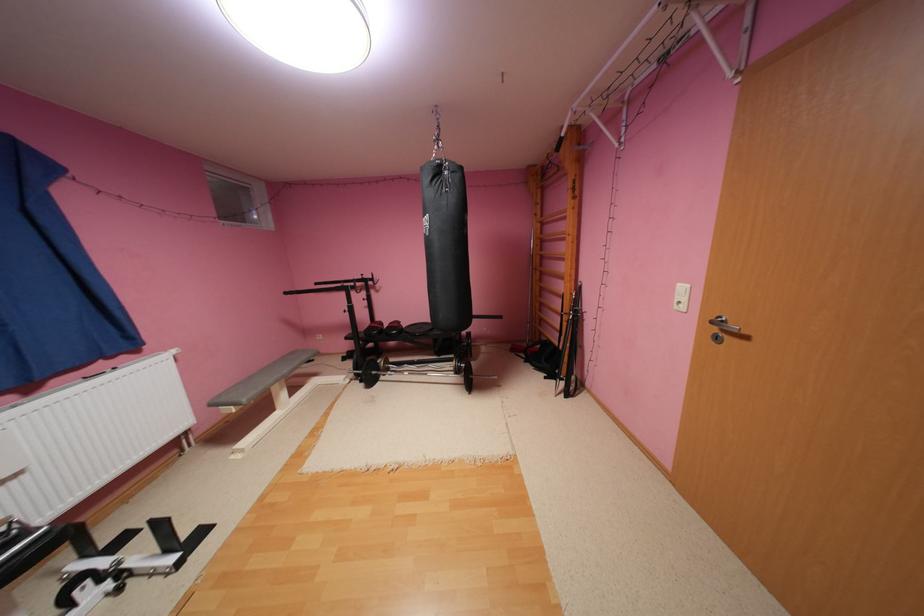
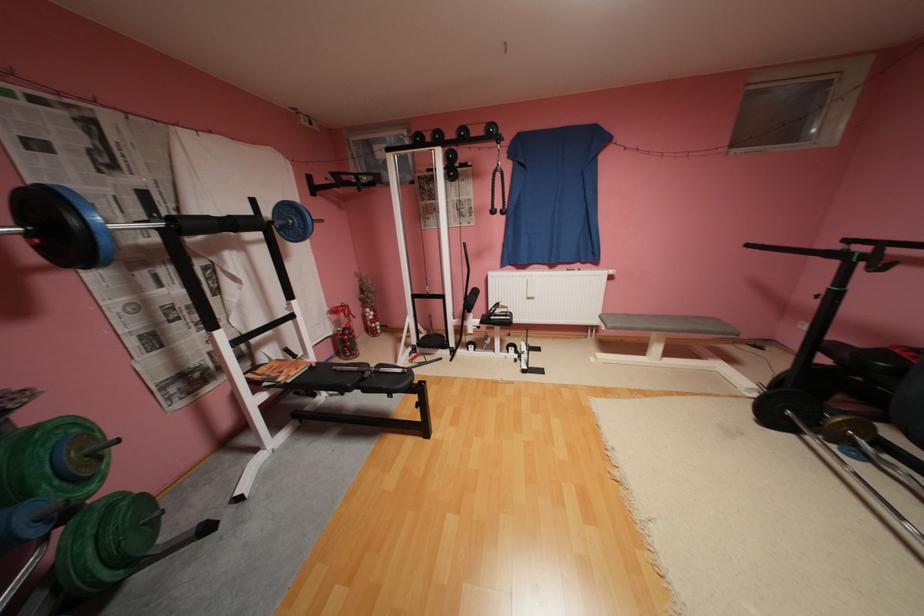
The images are taken continuously from a first-person perspective. In which direction is your viewpoint rotating?

The camera's rotation is toward left-down.